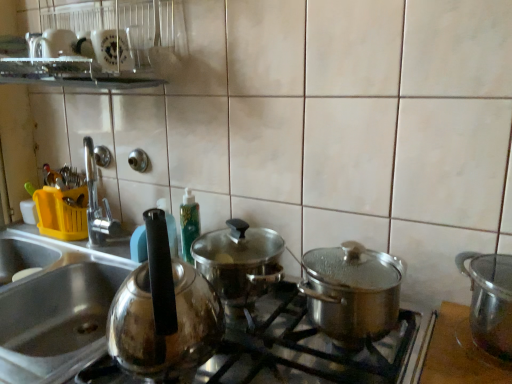
This screenshot has height=384, width=512. What do you see at coordinates (305, 349) in the screenshot? I see `shiny metallic pots at center` at bounding box center [305, 349].

Where is `satin silver sink at left`? The height and width of the screenshot is (384, 512). satin silver sink at left is located at coordinates (54, 308).

Can you tell me how much shiny metallic pot at right, the 2th kitchen appliance when ordered from left to right, and satin silver sink at left differ in facing direction?

0.198 degrees.

Is shiny metallic pot at right, which is the 1th kitchen appliance from right to left, to the right of satin silver sink at left from the viewer's perspective?

Yes, shiny metallic pot at right, which is the 1th kitchen appliance from right to left, is to the right of satin silver sink at left.

From a real-world perspective, which is physically below, shiny metallic pot at right, which is the 1th kitchen appliance from right to left, or satin silver sink at left?

From a 3D spatial view, satin silver sink at left is below.

Measure the distance between satin silver sink at left and shiny metallic pots at center.

A distance of 16.20 inches exists between satin silver sink at left and shiny metallic pots at center.

Is shiny metallic pots at center completely or partially inside satin silver sink at left?

No, shiny metallic pots at center is located outside of satin silver sink at left.

In the scene shown: Is satin silver sink at left further to camera compared to shiny metallic pots at center?

Yes, satin silver sink at left is further from the viewer.

From the picture: How much distance is there between shiny metallic pot at right, the 2th kitchen appliance when ordered from left to right, and shiny metallic pots at center?

11.03 inches.

Considering the positions of objects shiny metallic pot at right, which is the 1th kitchen appliance from right to left, and shiny metallic pots at center in the image provided, who is behind, shiny metallic pot at right, which is the 1th kitchen appliance from right to left, or shiny metallic pots at center?

shiny metallic pot at right, which is the 1th kitchen appliance from right to left, is further from the camera.

Looking at this image, between shiny metallic pot at right, the 2th kitchen appliance when ordered from left to right, and shiny metallic pots at center, which one has smaller width?

shiny metallic pot at right, the 2th kitchen appliance when ordered from left to right.

Considering the relative sizes of shiny metallic pot at right, which is the 1th kitchen appliance from right to left, and shiny metallic pots at center in the image provided, is shiny metallic pot at right, which is the 1th kitchen appliance from right to left, taller than shiny metallic pots at center?

Indeed, shiny metallic pot at right, which is the 1th kitchen appliance from right to left, has a greater height compared to shiny metallic pots at center.

Can you tell me how much shiny metallic pot at center, which is counted as the first kitchen appliance, starting from the left, and satin silver sink at left differ in facing direction?

1.6 degrees.

The image size is (512, 384). I want to click on the 2nd kitchen appliance above the satin silver sink at left (from a real-world perspective), so click(x=352, y=292).

From a real-world perspective, is shiny metallic pot at center, which is counted as the first kitchen appliance, starting from the left, on top of satin silver sink at left?

Yes, from a real-world perspective, shiny metallic pot at center, which is counted as the first kitchen appliance, starting from the left, is on top of satin silver sink at left.

Considering the positions of objects shiny metallic pot at center, which is counted as the first kitchen appliance, starting from the left, and satin silver sink at left in the image provided, who is more to the left, shiny metallic pot at center, which is counted as the first kitchen appliance, starting from the left, or satin silver sink at left?

satin silver sink at left is more to the left.

Considering the sizes of objects shiny metallic pot at center, which is counted as the first kitchen appliance, starting from the left, and shiny metallic pots at center in the image provided, who is shorter, shiny metallic pot at center, which is counted as the first kitchen appliance, starting from the left, or shiny metallic pots at center?

With less height is shiny metallic pot at center, which is counted as the first kitchen appliance, starting from the left.

Between shiny metallic pot at center, arranged as the 2th kitchen appliance when viewed from the right, and shiny metallic pots at center, which one has larger size?

shiny metallic pots at center is bigger.

Is shiny metallic pot at center, arranged as the 2th kitchen appliance when viewed from the right, at the right side of shiny metallic pots at center?

Yes.

From the image's perspective, who appears lower, shiny metallic pot at center, arranged as the 2th kitchen appliance when viewed from the right, or shiny metallic pots at center?

Result: shiny metallic pots at center.

Is shiny metallic pot at center, arranged as the 2th kitchen appliance when viewed from the right, not within shiny metallic pot at right, the 2th kitchen appliance when ordered from left to right?

shiny metallic pot at center, arranged as the 2th kitchen appliance when viewed from the right, is positioned outside shiny metallic pot at right, the 2th kitchen appliance when ordered from left to right.

Is shiny metallic pot at center, which is counted as the first kitchen appliance, starting from the left, positioned with its back to shiny metallic pot at right, the 2th kitchen appliance when ordered from left to right?

No, shiny metallic pot at center, which is counted as the first kitchen appliance, starting from the left,'s orientation is not away from shiny metallic pot at right, the 2th kitchen appliance when ordered from left to right.

Which is more to the right, shiny metallic pot at center, arranged as the 2th kitchen appliance when viewed from the right, or shiny metallic pot at right, which is the 1th kitchen appliance from right to left?

Positioned to the right is shiny metallic pot at right, which is the 1th kitchen appliance from right to left.

From the picture: Which object is more forward, shiny metallic pot at center, which is counted as the first kitchen appliance, starting from the left, or shiny metallic pot at right, which is the 1th kitchen appliance from right to left?

shiny metallic pot at center, which is counted as the first kitchen appliance, starting from the left, is in front.

Find the location of a particular element. The height and width of the screenshot is (384, 512). sink beneath the shiny metallic pot at center, which is counted as the first kitchen appliance, starting from the left (from a real-world perspective) is located at coordinates (54, 308).

Who is bigger, satin silver sink at left or shiny metallic pot at center, arranged as the 2th kitchen appliance when viewed from the right?

satin silver sink at left.

Could you tell me if satin silver sink at left is turned towards shiny metallic pot at center, arranged as the 2th kitchen appliance when viewed from the right?

No.

Is satin silver sink at left shorter than shiny metallic pot at center, arranged as the 2th kitchen appliance when viewed from the right?

No.

Where is `sink that appears below the shiny metallic pot at right, the 2th kitchen appliance when ordered from left to right (from a real-world perspective)`? sink that appears below the shiny metallic pot at right, the 2th kitchen appliance when ordered from left to right (from a real-world perspective) is located at coordinates (54, 308).

This screenshot has height=384, width=512. In order to click on sink on the left of shiny metallic pots at center in this screenshot , I will do `click(54, 308)`.

When comparing their distances from satin silver sink at left, does shiny metallic pot at right, which is the 1th kitchen appliance from right to left, or shiny metallic pot at center, arranged as the 2th kitchen appliance when viewed from the right, seem further?

Among the two, shiny metallic pot at right, which is the 1th kitchen appliance from right to left, is located further to satin silver sink at left.

When comparing their distances from shiny metallic pot at right, the 2th kitchen appliance when ordered from left to right, does shiny metallic pot at center, arranged as the 2th kitchen appliance when viewed from the right, or satin silver sink at left seem closer?

shiny metallic pot at center, arranged as the 2th kitchen appliance when viewed from the right, is positioned closer to the anchor shiny metallic pot at right, the 2th kitchen appliance when ordered from left to right.

Estimate the real-world distances between objects in this image. Which object is closer to shiny metallic pot at center, arranged as the 2th kitchen appliance when viewed from the right, satin silver sink at left or shiny metallic pots at center?

shiny metallic pots at center lies closer to shiny metallic pot at center, arranged as the 2th kitchen appliance when viewed from the right, than the other object.

Based on their spatial positions, is satin silver sink at left or shiny metallic pot at right, which is the 1th kitchen appliance from right to left, further from shiny metallic pot at center, arranged as the 2th kitchen appliance when viewed from the right?

satin silver sink at left lies further to shiny metallic pot at center, arranged as the 2th kitchen appliance when viewed from the right, than the other object.

Which object lies nearer to the anchor point shiny metallic pot at center, arranged as the 2th kitchen appliance when viewed from the right, shiny metallic pot at right, the 2th kitchen appliance when ordered from left to right, or shiny metallic pots at center?

Among the two, shiny metallic pots at center is located nearer to shiny metallic pot at center, arranged as the 2th kitchen appliance when viewed from the right.

Which object lies nearer to the anchor point satin silver sink at left, shiny metallic pots at center or shiny metallic pot at center, which is counted as the first kitchen appliance, starting from the left?

shiny metallic pots at center is closer to satin silver sink at left.

Based on their spatial positions, is shiny metallic pot at center, which is counted as the first kitchen appliance, starting from the left, or shiny metallic pots at center further from satin silver sink at left?

shiny metallic pot at center, which is counted as the first kitchen appliance, starting from the left, lies further to satin silver sink at left than the other object.

Considering their positions, is shiny metallic pot at right, which is the 1th kitchen appliance from right to left, positioned closer to satin silver sink at left than shiny metallic pots at center?

shiny metallic pots at center is closer to satin silver sink at left.

Find the location of `kitchen appliance situated between satin silver sink at left and shiny metallic pot at right, which is the 1th kitchen appliance from right to left, from left to right`. kitchen appliance situated between satin silver sink at left and shiny metallic pot at right, which is the 1th kitchen appliance from right to left, from left to right is located at coordinates (352, 292).

Identify the location of kitchen appliance between shiny metallic pots at center and shiny metallic pot at right, the 2th kitchen appliance when ordered from left to right, from left to right. (352, 292).

Where is `gas stove between satin silver sink at left and shiny metallic pot at center, arranged as the 2th kitchen appliance when viewed from the right, in the horizontal direction`? Image resolution: width=512 pixels, height=384 pixels. gas stove between satin silver sink at left and shiny metallic pot at center, arranged as the 2th kitchen appliance when viewed from the right, in the horizontal direction is located at coordinates (305, 349).

Locate an element on the screen. The height and width of the screenshot is (384, 512). gas stove located between satin silver sink at left and shiny metallic pot at right, the 2th kitchen appliance when ordered from left to right, in the left-right direction is located at coordinates (305, 349).